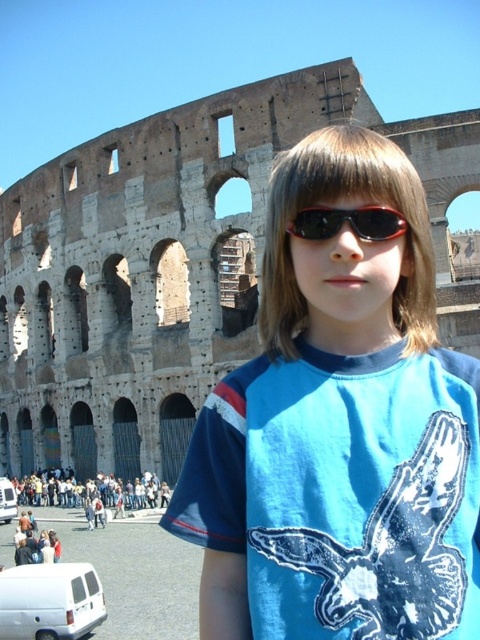
You are a photographer planning to take a picture of the blue cotton shirt at center while ensuring the Colosseum remains in the background. Based on the coordinates provided, will the shirt be positioned in a way that the Colosseum is still visible behind it?

The blue cotton shirt at center is located at point (339,429), which places it within the frame such that the Colosseum remains visible in the background.

You are a photographer trying to capture a candid shot of the person at the Colosseum. Since the blue cotton shirt at center and the black plastic sunglasses at center are both visible, can you determine which one is positioned more to the left?

The blue cotton shirt at center is to the left of the black plastic sunglasses at center, so the blue cotton shirt at center is positioned more to the left.